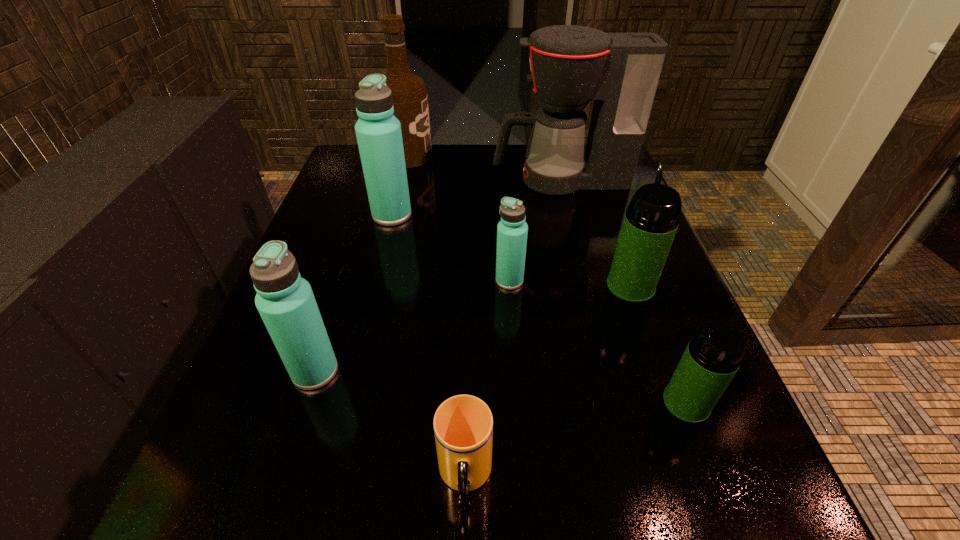
What are the coordinates of `vacant region between the nearest aqua thermos bottle and the shortest object` in the screenshot? It's located at (390, 424).

Find the location of a particular element. This screenshot has width=960, height=540. free space that is in between the alcohol and the coffee maker is located at coordinates (484, 168).

The image size is (960, 540). I want to click on free area in between the alcohol and the fifth object from right to left, so click(437, 317).

Locate an element on the screen. free point between the nearer green thermos bottle and the brown alcohol is located at coordinates (547, 280).

Where is `vacant space that is in between the rightmost aqua thermos bottle and the coffee maker`? vacant space that is in between the rightmost aqua thermos bottle and the coffee maker is located at coordinates (535, 231).

At what (x,y) coordinates should I click in order to perform the action: click on the fourth closest object to the nearest object. Please return your answer as a coordinate pair (x, y). The width and height of the screenshot is (960, 540). Looking at the image, I should click on (651, 220).

The height and width of the screenshot is (540, 960). I want to click on object that stands as the fourth closest to the shortest object, so click(x=651, y=220).

Select which thermos bottle appears as the fifth closest to the coffee maker. Please provide its 2D coordinates. Your answer should be formatted as a tuple, i.e. [(x, y)], where the tuple contains the x and y coordinates of a point satisfying the conditions above.

[(285, 301)]

Locate which thermos bottle is the third closest to the nearer green thermos bottle. Please provide its 2D coordinates. Your answer should be formatted as a tuple, i.e. [(x, y)], where the tuple contains the x and y coordinates of a point satisfying the conditions above.

[(285, 301)]

Locate an element on the screen. aqua thermos bottle that can be found as the third closest to the cup is located at coordinates (378, 131).